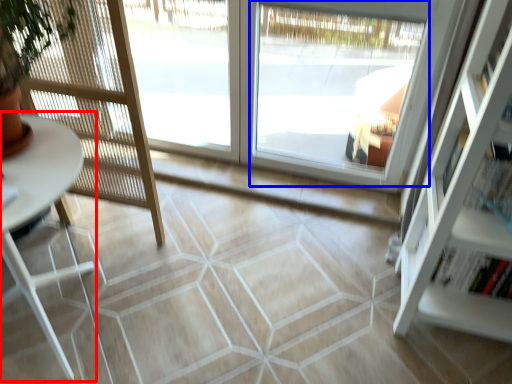
Question: Which object is further to the camera taking this photo, table (highlighted by a red box) or window (highlighted by a blue box)?

Choices:
 (A) table
 (B) window

Answer: (B)